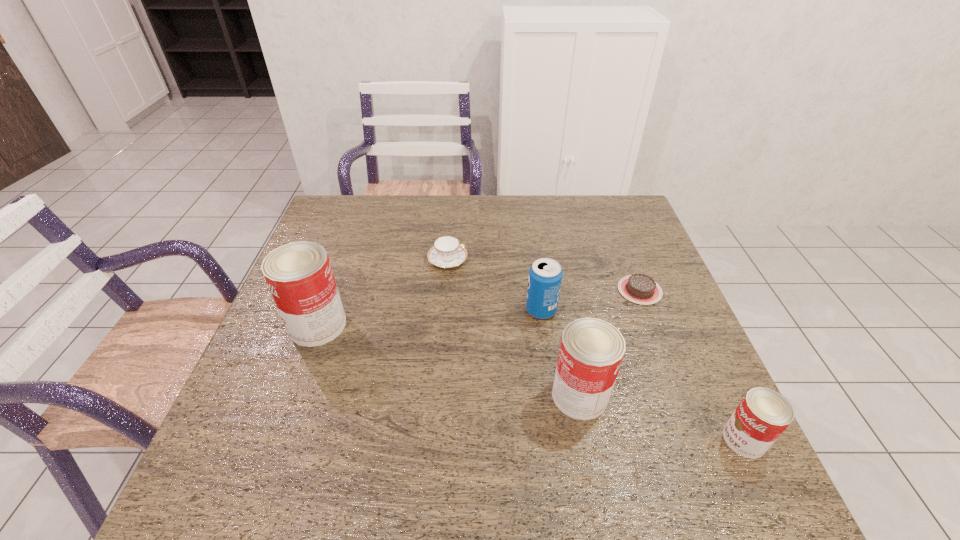
Locate an element on the screen. This screenshot has height=540, width=960. the leftmost object is located at coordinates (299, 275).

This screenshot has height=540, width=960. In order to click on the leftmost can in this screenshot , I will do `click(299, 275)`.

This screenshot has height=540, width=960. I want to click on the fifth farthest object, so click(x=591, y=351).

This screenshot has width=960, height=540. Identify the location of the second tallest object. (591, 351).

This screenshot has height=540, width=960. Identify the location of the nearest can. (762, 416).

Where is `the rightmost can`? The image size is (960, 540). the rightmost can is located at coordinates (762, 416).

The width and height of the screenshot is (960, 540). What are the coordinates of `chocolate cake` in the screenshot? It's located at (638, 288).

The width and height of the screenshot is (960, 540). What are the coordinates of `the second object from left to right` in the screenshot? It's located at (447, 252).

Identify the location of the fifth tallest object. The image size is (960, 540). (447, 252).

Locate an element on the screen. soda can is located at coordinates (545, 275).